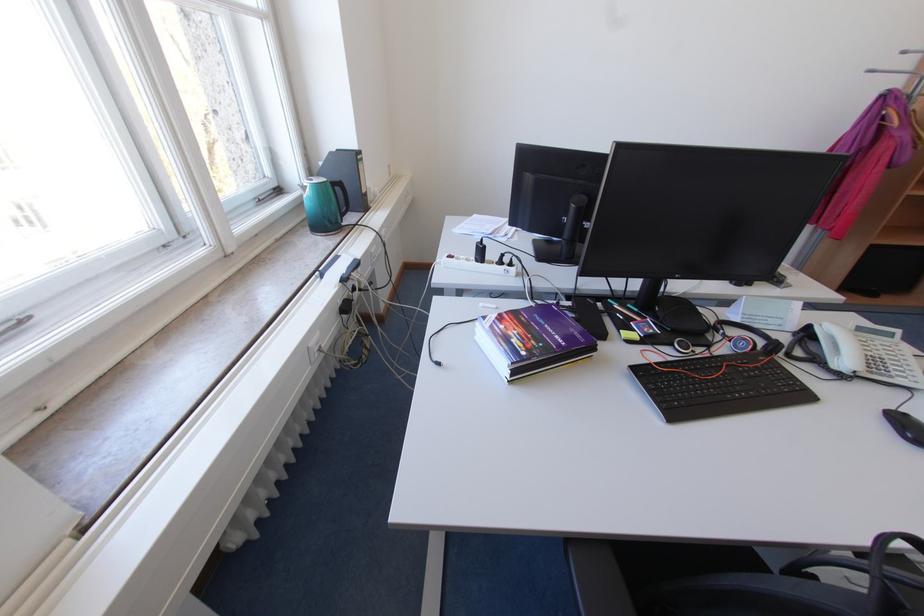
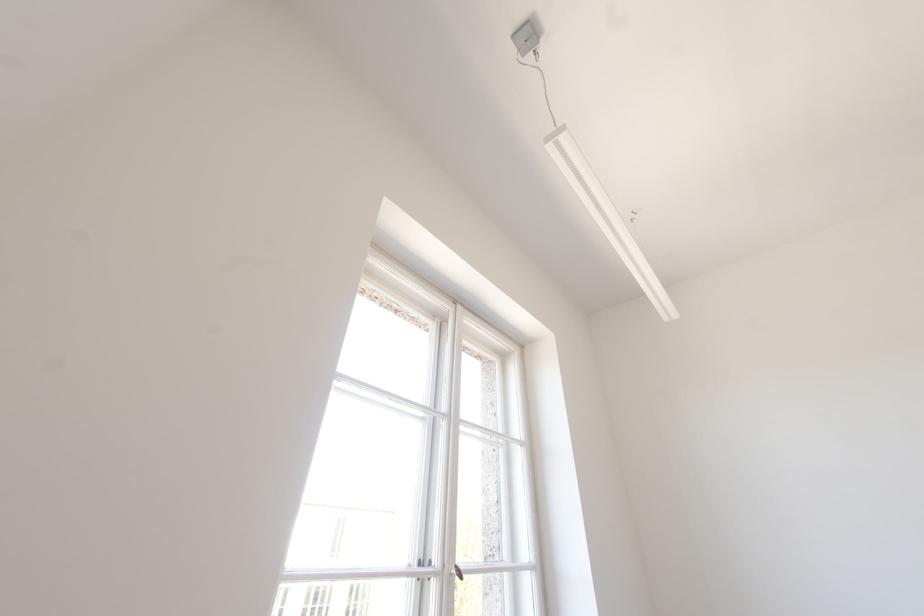
How did the camera likely rotate?

The camera's rotation is toward left-up.